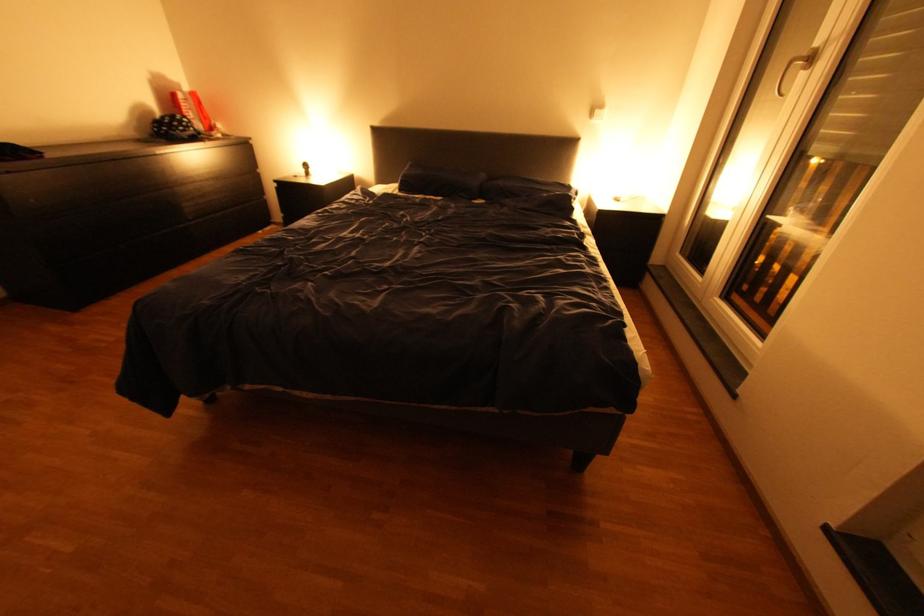
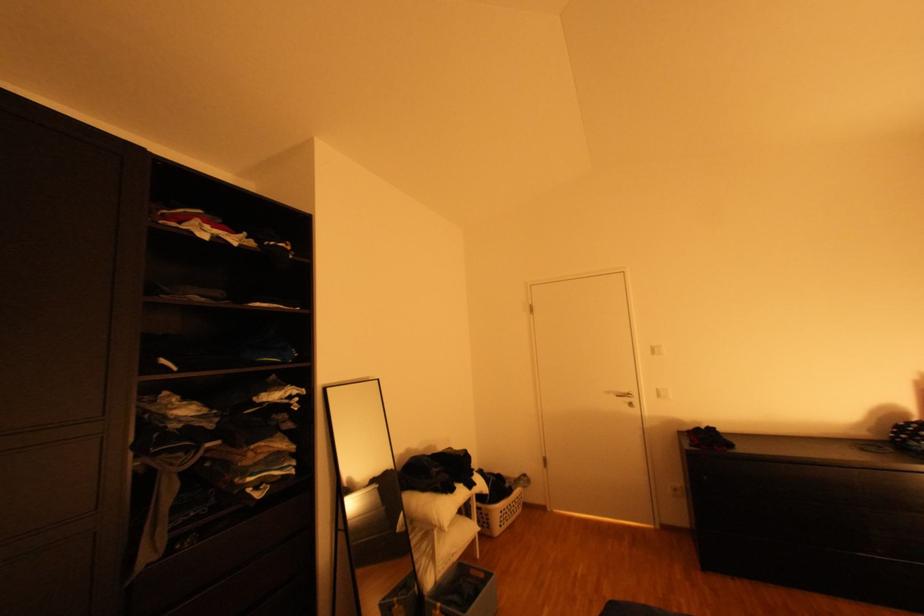
In the second image, find the point that corresponds to pixel 43 200 in the first image.

(715, 477)